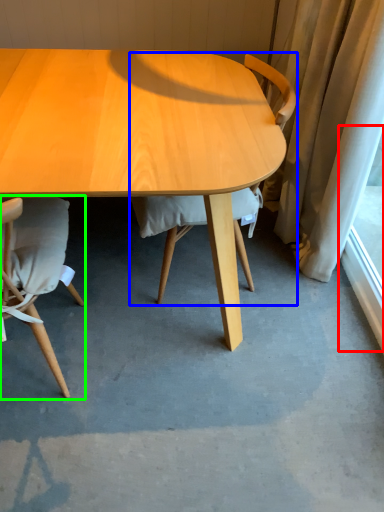
Question: Which object is the closest to the window screen (highlighted by a red box)? Choose among these: chair (highlighted by a blue box) or chair (highlighted by a green box).

Choices:
 (A) chair
 (B) chair

Answer: (A)